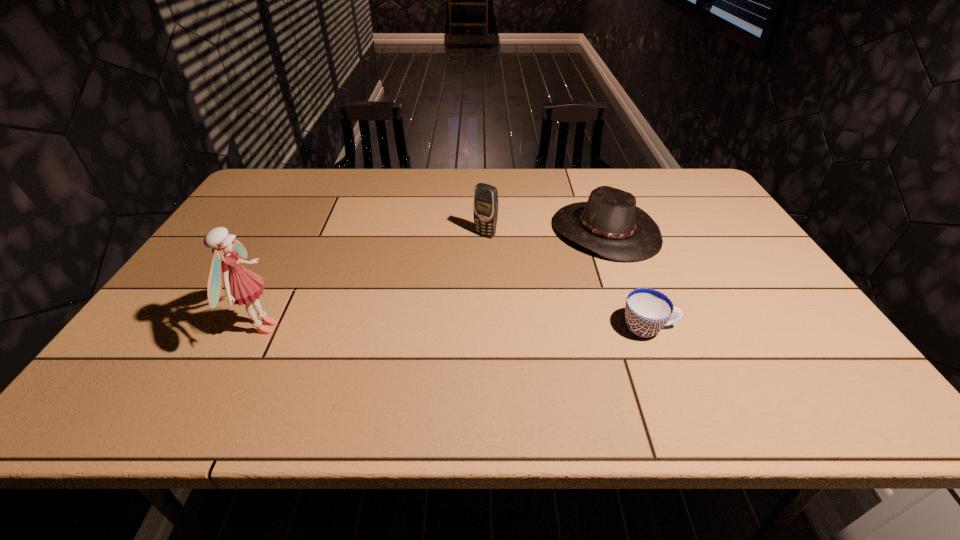
You are a GUI agent. You are given a task and a screenshot of the screen. Output one action in this format:
    pyautogui.click(x=<x>, y=<y>)
    Task: Click on the leftmost object
    The height and width of the screenshot is (540, 960).
    Given the screenshot: What is the action you would take?
    pyautogui.click(x=242, y=286)

Locate an element on the screen. the tallest object is located at coordinates (242, 286).

Image resolution: width=960 pixels, height=540 pixels. I want to click on the shortest object, so click(647, 311).

Find the location of `cellular telephone`. cellular telephone is located at coordinates (485, 204).

Image resolution: width=960 pixels, height=540 pixels. Find the location of `the second object from left to right`. the second object from left to right is located at coordinates (485, 204).

The width and height of the screenshot is (960, 540). Identify the location of hat. (610, 224).

Locate an element on the screen. The image size is (960, 540). free region located 0.150m on the front-facing side of the tallest object is located at coordinates (344, 328).

Find the location of `blank area located 0.100m on the side of the cup with the handle`. blank area located 0.100m on the side of the cup with the handle is located at coordinates (720, 328).

Where is `free point located 0.260m on the front face of the third object from right to left`? free point located 0.260m on the front face of the third object from right to left is located at coordinates (432, 292).

Locate an element on the screen. Image resolution: width=960 pixels, height=540 pixels. vacant space located 0.100m on the front face of the third object from right to left is located at coordinates (463, 258).